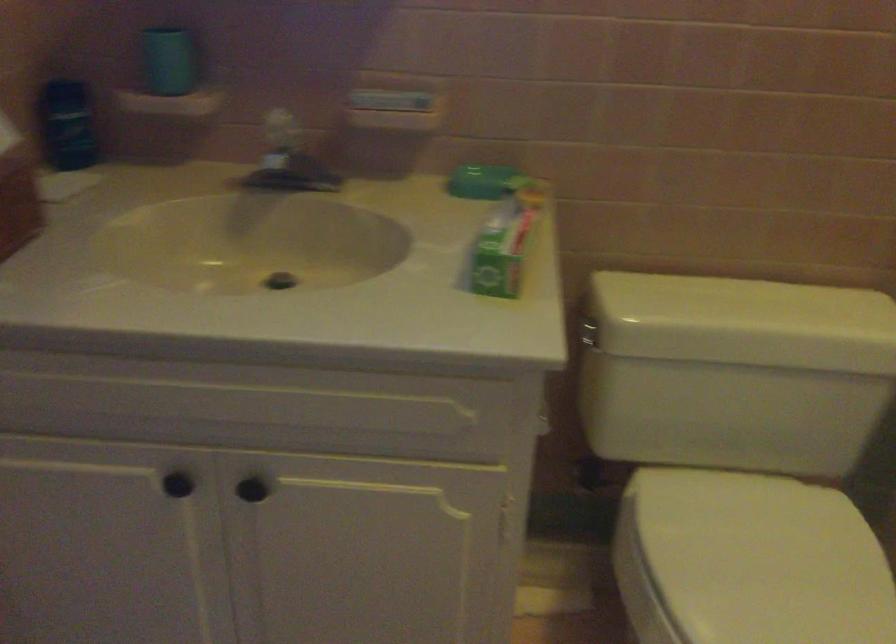
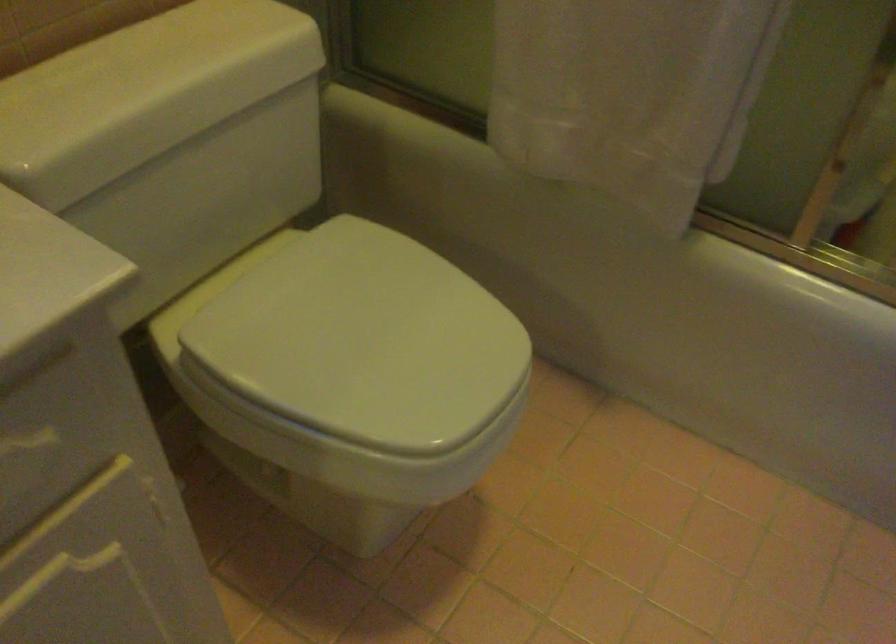
First-person continuous shooting, in which direction is the camera rotating?

The camera rotated toward right-down.